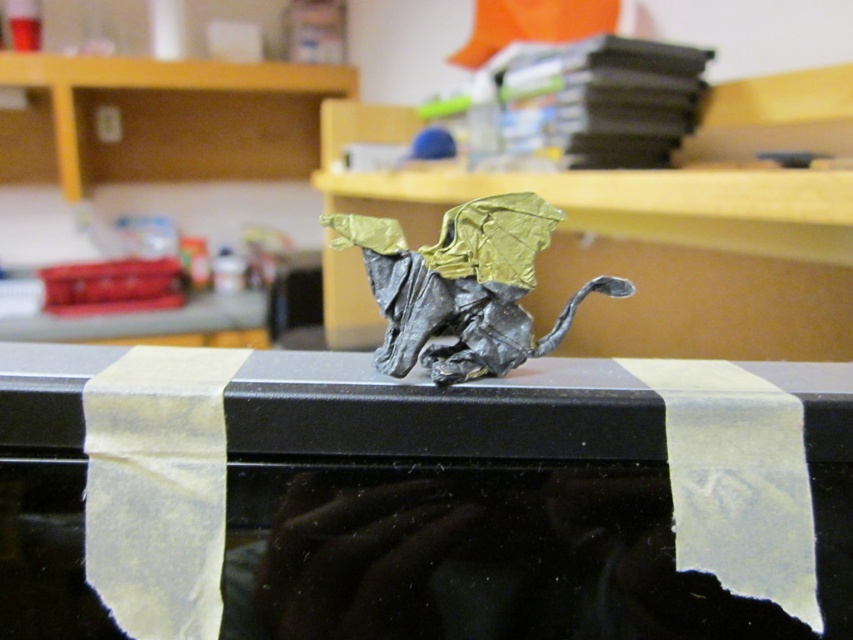
Question: Observing the image, what is the correct spatial positioning of metallic gold origami at center in reference to gold metallic dragon at center?

Choices:
 (A) below
 (B) above

Answer: (A)

Question: Is metallic gold origami at center wider than gold metallic dragon at center?

Choices:
 (A) no
 (B) yes

Answer: (B)

Question: Observing the image, what is the correct spatial positioning of metallic gold origami at center in reference to gold metallic dragon at center?

Choices:
 (A) below
 (B) above

Answer: (A)

Question: Which point is farther to the camera?

Choices:
 (A) (10, 528)
 (B) (405, 349)

Answer: (B)